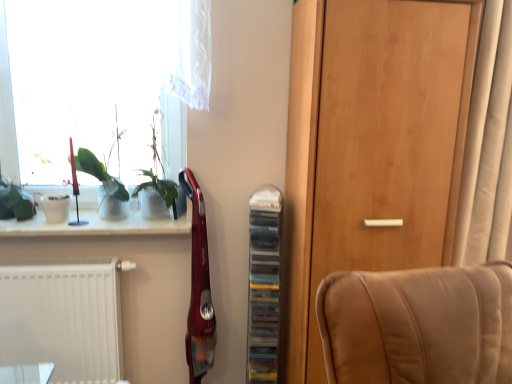
Question: Is wooden door at center outside transparent glass window at upper left?

Choices:
 (A) yes
 (B) no

Answer: (A)

Question: Is wooden door at center oriented towards transparent glass window at upper left?

Choices:
 (A) yes
 (B) no

Answer: (B)

Question: Is wooden door at center positioned in front of transparent glass window at upper left?

Choices:
 (A) no
 (B) yes

Answer: (B)

Question: Considering the relative sizes of wooden door at center and transparent glass window at upper left in the image provided, is wooden door at center bigger than transparent glass window at upper left?

Choices:
 (A) yes
 (B) no

Answer: (A)

Question: From a real-world perspective, is wooden door at center physically below transparent glass window at upper left?

Choices:
 (A) yes
 (B) no

Answer: (A)

Question: Considering the positions of white matte radiator at lower left and transparent glass window at upper left in the image, is white matte radiator at lower left wider or thinner than transparent glass window at upper left?

Choices:
 (A) wide
 (B) thin

Answer: (B)

Question: Considering the positions of white matte radiator at lower left and transparent glass window at upper left in the image, is white matte radiator at lower left taller or shorter than transparent glass window at upper left?

Choices:
 (A) short
 (B) tall

Answer: (A)

Question: From the image's perspective, is white matte radiator at lower left located above or below transparent glass window at upper left?

Choices:
 (A) above
 (B) below

Answer: (B)

Question: Visually, is white matte radiator at lower left positioned to the left or to the right of transparent glass window at upper left?

Choices:
 (A) right
 (B) left

Answer: (B)

Question: Is green matte plant at left bigger or smaller than transparent glass window at upper left?

Choices:
 (A) big
 (B) small

Answer: (B)

Question: Considering the relative positions of green matte plant at left and transparent glass window at upper left in the image provided, is green matte plant at left to the left or to the right of transparent glass window at upper left?

Choices:
 (A) right
 (B) left

Answer: (A)

Question: Is green matte plant at left inside or outside of transparent glass window at upper left?

Choices:
 (A) outside
 (B) inside

Answer: (B)

Question: From a real-world perspective, relative to transparent glass window at upper left, is green matte plant at left vertically above or below?

Choices:
 (A) above
 (B) below

Answer: (B)

Question: From the image's perspective, is wooden door at center located above or below beige fabric curtain at right?

Choices:
 (A) below
 (B) above

Answer: (A)

Question: Is wooden door at center situated inside beige fabric curtain at right or outside?

Choices:
 (A) inside
 (B) outside

Answer: (B)